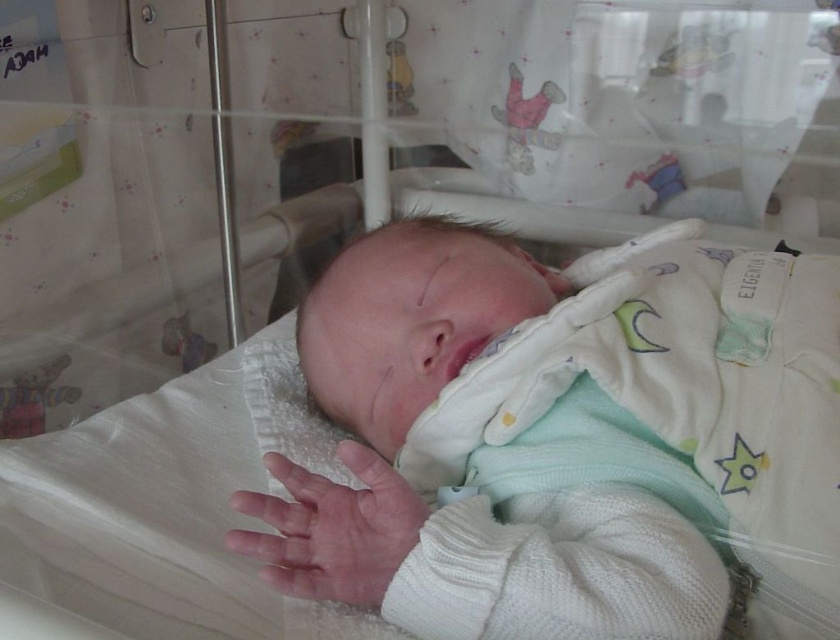
You are a nurse in the NICU and need to check the baby inside the incubator. The white knitted sweater at center and the pink soft skin at center are both visible. Which one is taller?

The white knitted sweater at center has a greater height compared to the pink soft skin at center, so the white knitted sweater at center is taller.

Looking at the newborn baby in the incubator, can you tell me which item is positioned to the right of the other between the white knitted sweater at center and the pink soft skin at center?

The white knitted sweater at center is positioned to the right of the pink soft skin at center.